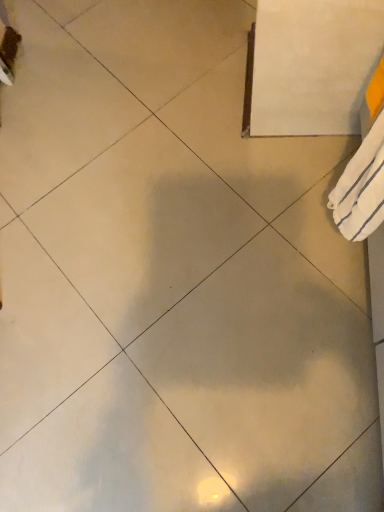
Locate an element on the screen. white striped towel at right is located at coordinates (361, 188).

Describe the element at coordinates (361, 188) in the screenshot. The height and width of the screenshot is (512, 384). I see `white striped towel at right` at that location.

At what (x,y) coordinates should I click in order to perform the action: click on white striped towel at right. Please return your answer as a coordinate pair (x, y). This screenshot has height=512, width=384. Looking at the image, I should click on (361, 188).